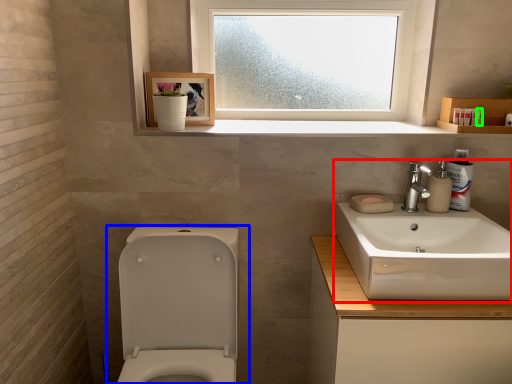
Question: Which object is positioned closest to sink (highlighted by a red box)? Select from toilet (highlighted by a blue box) and toiletry (highlighted by a green box).

Choices:
 (A) toilet
 (B) toiletry

Answer: (B)